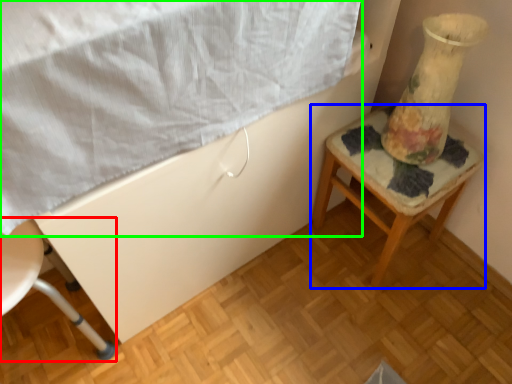
Question: Based on their relative distances, which object is nearer to chair (highlighted by a red box)? Choose from furniture (highlighted by a blue box) and sheet (highlighted by a green box).

Choices:
 (A) furniture
 (B) sheet

Answer: (B)